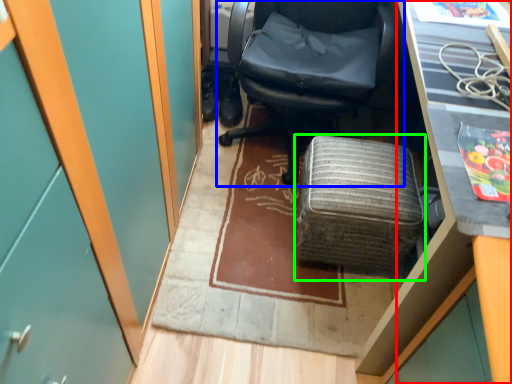
Question: Considering the real-world distances, which object is closest to desk (highlighted by a red box)? chair (highlighted by a blue box) or furniture (highlighted by a green box).

Choices:
 (A) chair
 (B) furniture

Answer: (B)